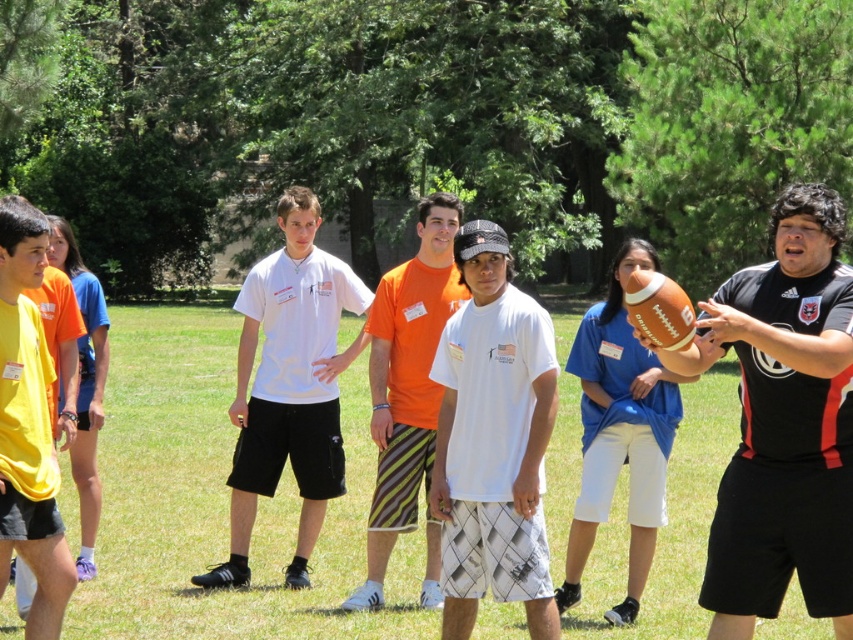
Question: Considering the relative positions of white matte t-shirt at center and yellow matte shirt at left in the image provided, where is white matte t-shirt at center located with respect to yellow matte shirt at left?

Choices:
 (A) above
 (B) below

Answer: (B)

Question: Does white textured shirt at center appear on the right side of orange striped shorts at center?

Choices:
 (A) no
 (B) yes

Answer: (B)

Question: Which object is positioned farthest from the yellow matte shirt at left?

Choices:
 (A) orange striped shorts at center
 (B) white textured shirt at center

Answer: (A)

Question: Is black matte jersey at right below yellow matte shirt at left?

Choices:
 (A) no
 (B) yes

Answer: (A)

Question: Among these points, which one is farthest from the camera?

Choices:
 (A) (714, 515)
 (B) (607, 513)

Answer: (B)

Question: Among these objects, which one is nearest to the camera?

Choices:
 (A) white matte t-shirt at center
 (B) white textured shirt at center
 (C) blue fabric shirt at center
 (D) orange striped shorts at center

Answer: (B)